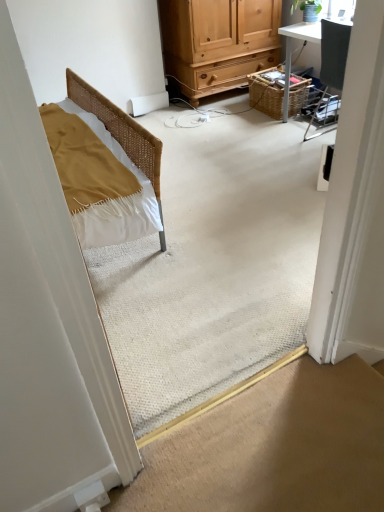
At what (x,y) coordinates should I click in order to perform the action: click on woven brown basket at center. Please return your answer as a coordinate pair (x, y). Looking at the image, I should click on (266, 94).

This screenshot has width=384, height=512. What do you see at coordinates (266, 94) in the screenshot?
I see `woven brown basket at center` at bounding box center [266, 94].

The width and height of the screenshot is (384, 512). Identify the location of woven brown basket at center. (266, 94).